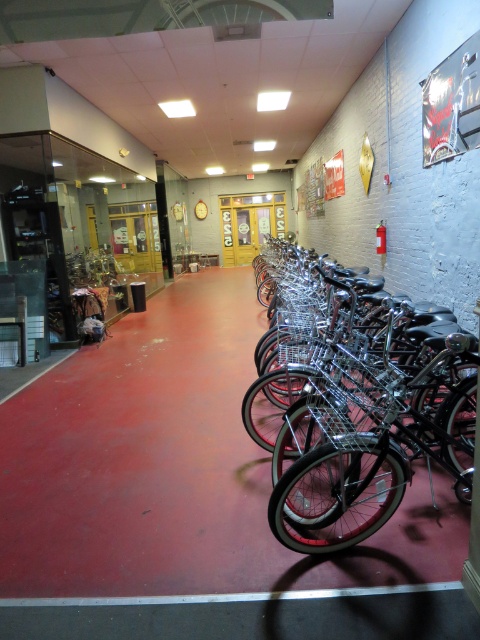
Which is below, shiny black bicycle at right or white glossy line at lower center?

white glossy line at lower center is lower down.

Can you confirm if shiny black bicycle at right is positioned above white glossy line at lower center?

Correct, shiny black bicycle at right is located above white glossy line at lower center.

Which is in front, point (368, 413) or point (266, 592)?

Point (266, 592)

Find the location of a particular element. shiny black bicycle at right is located at coordinates (357, 426).